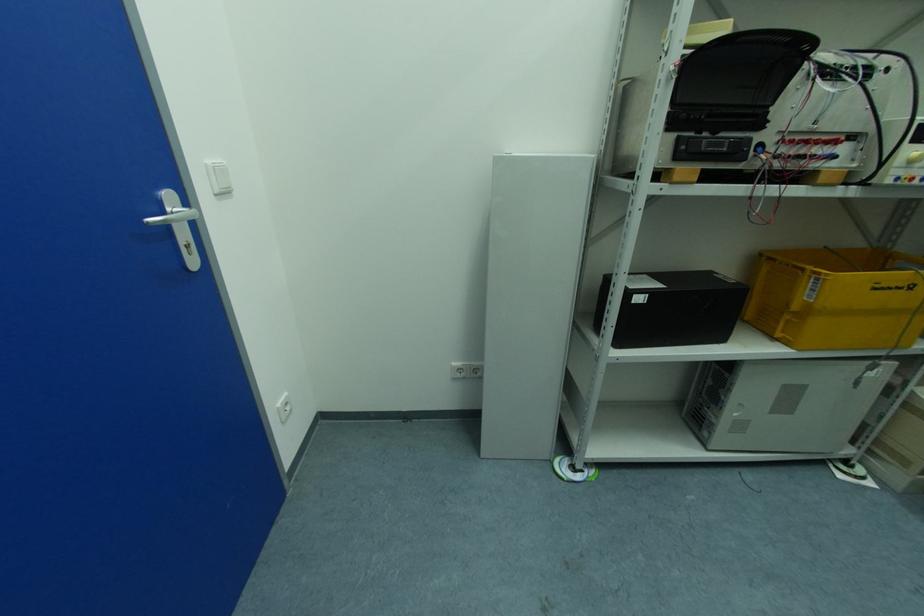
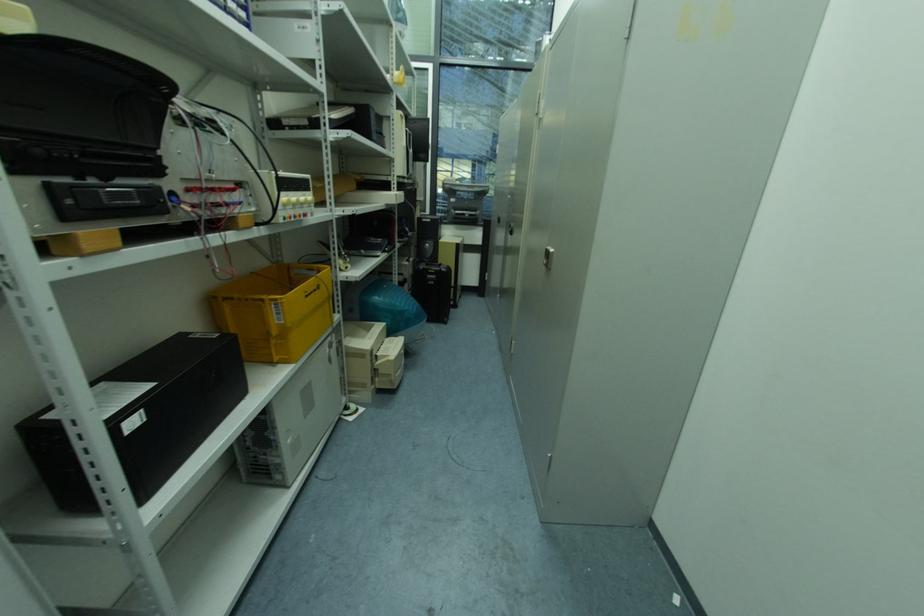
The images are taken continuously from a first-person perspective. In which direction is your viewpoint rotating?

The camera's rotation is toward right-down.